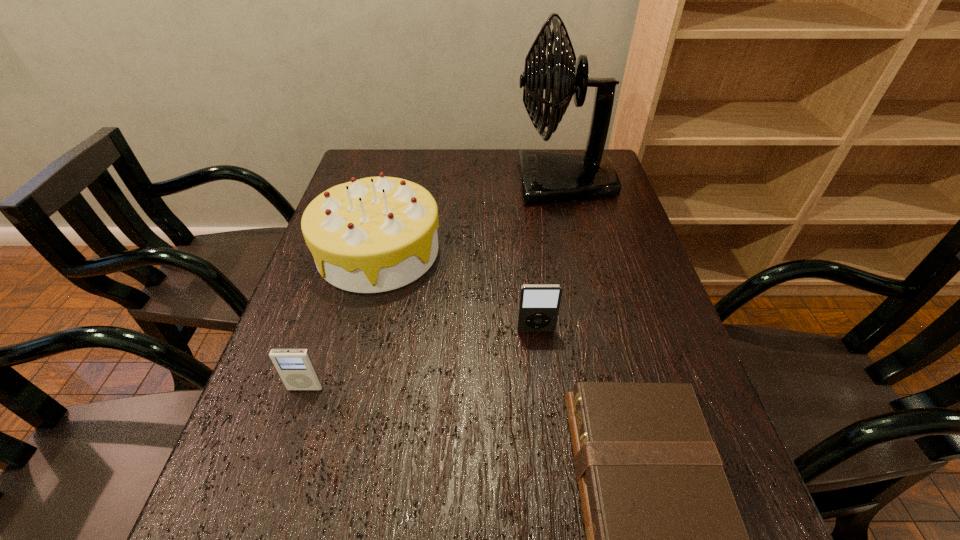
Identify the location of the tallest object. (546, 177).

Locate an element on the screen. This screenshot has height=540, width=960. fan is located at coordinates (546, 177).

Where is `the second farthest object`? the second farthest object is located at coordinates (375, 234).

Locate an element on the screen. Image resolution: width=960 pixels, height=540 pixels. birthday cake is located at coordinates (375, 234).

You are a GUI agent. You are given a task and a screenshot of the screen. Output one action in this format:
    pyautogui.click(x=<x>, y=<y>)
    Task: Click on the third farthest object
    The height and width of the screenshot is (540, 960).
    Given the screenshot: What is the action you would take?
    pyautogui.click(x=539, y=304)

This screenshot has height=540, width=960. I want to click on the right iPod, so click(x=539, y=304).

Where is `the second shortest object`? This screenshot has height=540, width=960. the second shortest object is located at coordinates (296, 367).

Identify the location of the fourth farthest object. This screenshot has height=540, width=960. (296, 367).

At what (x,y) coordinates should I click in order to perform the action: click on vacant point located 0.250m in front of the farthest object to blow air. Please return your answer as a coordinate pair (x, y). This screenshot has width=960, height=540. Looking at the image, I should click on (434, 183).

Identify the location of vacant space located in front of the farthest object to blow air. (430, 183).